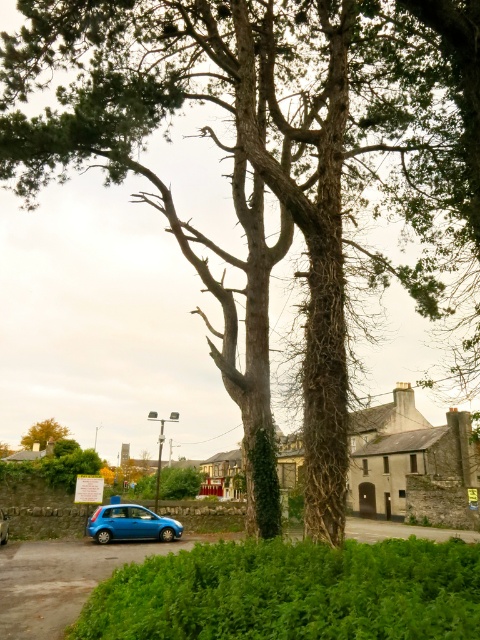
Question: Which object is the farthest from the brown rough tree at lower left?

Choices:
 (A) blue matte car at lower left
 (B) green leafy hedge at lower center
 (C) metallic blue hatchback at lower left

Answer: (B)

Question: Which object is the closest to the metallic blue hatchback at lower left?

Choices:
 (A) blue matte car at lower left
 (B) brown rough tree at lower left

Answer: (A)

Question: From the image, what is the correct spatial relationship of metallic blue hatchback at lower left in relation to brown rough tree at lower left?

Choices:
 (A) above
 (B) below

Answer: (A)

Question: Does green leafy hedge at lower center have a greater width compared to metallic blue hatchback at lower left?

Choices:
 (A) no
 (B) yes

Answer: (A)

Question: Where is brown rough tree at lower left located in relation to blue matte car at lower left in the image?

Choices:
 (A) left
 (B) right

Answer: (A)

Question: Which point is closer to the camera?

Choices:
 (A) (3, 529)
 (B) (108, 518)
 (C) (406, 564)
 (D) (25, 436)

Answer: (C)